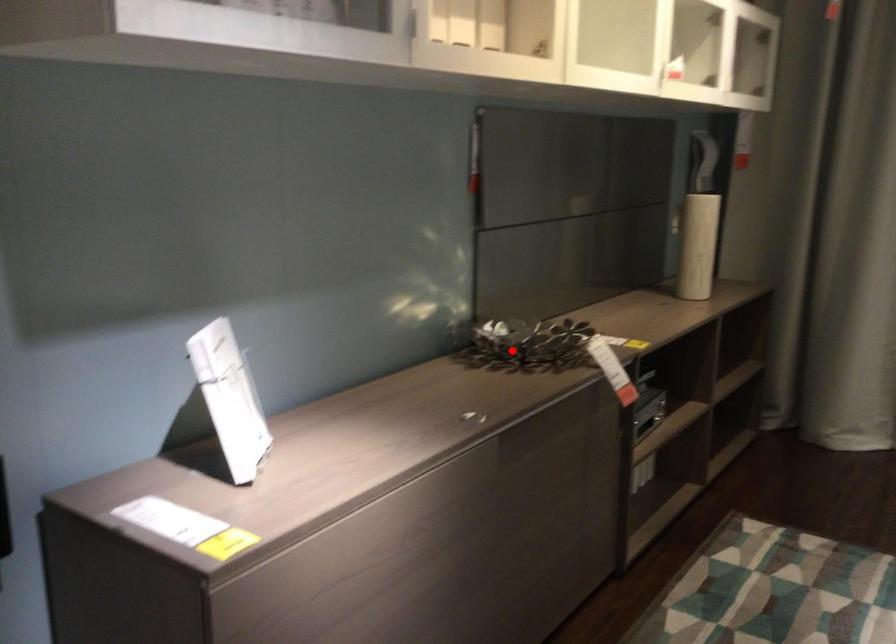
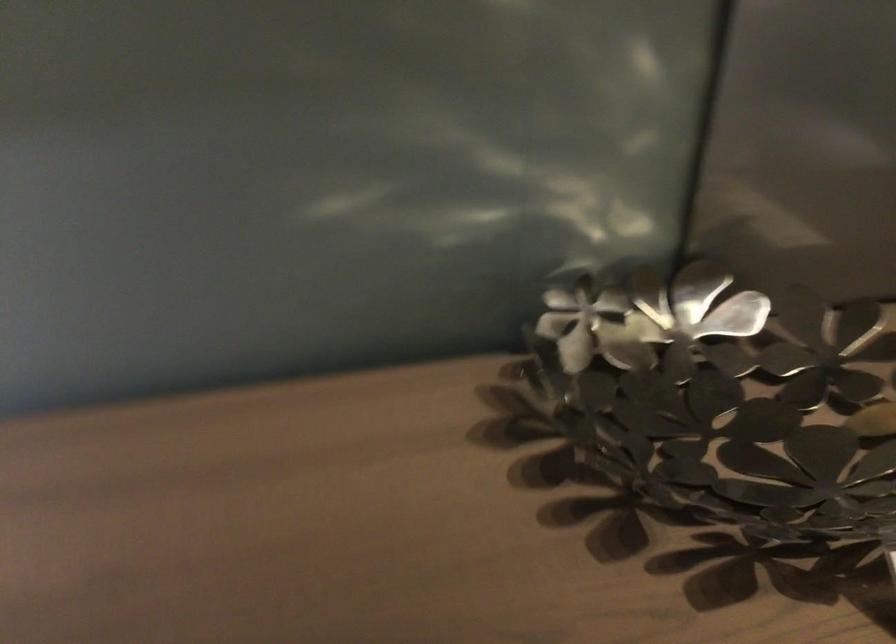
Question: I am providing you with two images of the same scene from different viewpoints. Image1 has a red point marked. In image2, the corresponding 3D location appears at what relative position? Reply with the corresponding letter.

Choices:
 (A) Closer
 (B) Farther

Answer: (A)